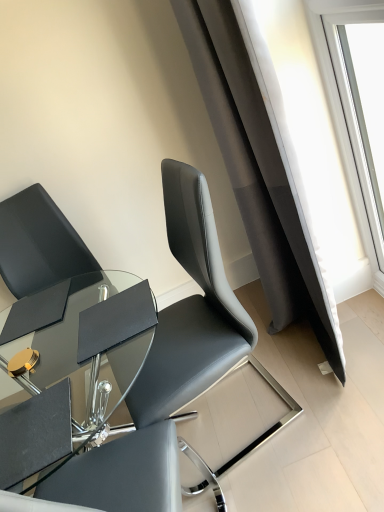
Describe the element at coordinates (66, 302) in the screenshot. I see `black leather chair at left, positioned as the 2th chair in right-to-left order` at that location.

Image resolution: width=384 pixels, height=512 pixels. Describe the element at coordinates (356, 136) in the screenshot. I see `transparent glass window at upper right` at that location.

The height and width of the screenshot is (512, 384). I want to click on black leather chair at left, the first chair when ordered from left to right, so click(66, 302).

Which is more to the left, black leather chair at left, the first chair when ordered from left to right, or matte black chair at upper left, the second chair from the left?

Positioned to the left is black leather chair at left, the first chair when ordered from left to right.

Locate an element on the screen. This screenshot has width=384, height=512. chair below the matte black chair at upper left, the second chair from the left (from the image's perspective) is located at coordinates (66, 302).

From the image's perspective, which is above, black leather chair at left, the first chair when ordered from left to right, or matte black chair at upper left, which is the first chair from right to left?

matte black chair at upper left, which is the first chair from right to left, from the image's perspective.

Does black leather chair at left, the first chair when ordered from left to right, have a greater width compared to matte black chair at upper left, the second chair from the left?

Indeed, black leather chair at left, the first chair when ordered from left to right, has a greater width compared to matte black chair at upper left, the second chair from the left.

Is transparent glass window at upper right taller than matte black chair at upper left, the second chair from the left?

Yes.

Would you say transparent glass window at upper right is a long distance from matte black chair at upper left, which is the first chair from right to left?

They are positioned close to each other.

Is transparent glass window at upper right surrounding matte black chair at upper left, the second chair from the left?

No, matte black chair at upper left, the second chair from the left, is not surrounded by transparent glass window at upper right.

Which is more to the right, transparent glass window at upper right or matte black chair at upper left, which is the first chair from right to left?

transparent glass window at upper right is more to the right.

This screenshot has width=384, height=512. Identify the location of window that appears above the black leather chair at left, the first chair when ordered from left to right (from the image's perspective). (356, 136).

From the image's perspective, which is above, transparent glass window at upper right or black leather chair at left, positioned as the 2th chair in right-to-left order?

transparent glass window at upper right appears higher in the image.

Does transparent glass window at upper right lie behind black leather chair at left, the first chair when ordered from left to right?

No, the depth of transparent glass window at upper right is less than that of black leather chair at left, the first chair when ordered from left to right.

Is point (337, 91) in front of point (47, 276)?

Yes, point (337, 91) is closer to viewer.

Could you tell me if matte black chair at upper left, which is the first chair from right to left, is turned towards black leather chair at left, positioned as the 2th chair in right-to-left order?

No.

From the image's perspective, between matte black chair at upper left, the second chair from the left, and black leather chair at left, positioned as the 2th chair in right-to-left order, which one is located above?

From the image's view, matte black chair at upper left, the second chair from the left, is above.

This screenshot has height=512, width=384. I want to click on chair in front of the black leather chair at left, positioned as the 2th chair in right-to-left order, so click(197, 325).

Is matte black chair at upper left, which is the first chair from right to left, next to black leather chair at left, the first chair when ordered from left to right?

No, matte black chair at upper left, which is the first chair from right to left, is not next to black leather chair at left, the first chair when ordered from left to right.

From a real-world perspective, which is physically below, matte black chair at upper left, which is the first chair from right to left, or transparent glass window at upper right?

matte black chair at upper left, which is the first chair from right to left, is physically lower.

Is matte black chair at upper left, which is the first chair from right to left, looking in the opposite direction of transparent glass window at upper right?

Yes, matte black chair at upper left, which is the first chair from right to left, is facing away from transparent glass window at upper right.

From the image's perspective, is matte black chair at upper left, the second chair from the left, positioned above or below transparent glass window at upper right?

Clearly, from the image's perspective, matte black chair at upper left, the second chair from the left, is below transparent glass window at upper right.

Who is more distant, matte black chair at upper left, the second chair from the left, or transparent glass window at upper right?

transparent glass window at upper right is more distant.

Is black leather chair at left, the first chair when ordered from left to right, inside the boundaries of transparent glass window at upper right, or outside?

black leather chair at left, the first chair when ordered from left to right, cannot be found inside transparent glass window at upper right.

From the picture: Between black leather chair at left, positioned as the 2th chair in right-to-left order, and transparent glass window at upper right, which one has smaller width?

With smaller width is transparent glass window at upper right.

From a real-world perspective, is black leather chair at left, the first chair when ordered from left to right, physically below transparent glass window at upper right?

Yes, from a real-world perspective, black leather chair at left, the first chair when ordered from left to right, is below transparent glass window at upper right.

You are a GUI agent. You are given a task and a screenshot of the screen. Output one action in this format:
    pyautogui.click(x=<x>, y=<y>)
    Task: Click on the chair located on the left of matte black chair at upper left, which is the first chair from right to left
    This screenshot has height=512, width=384.
    Given the screenshot: What is the action you would take?
    pyautogui.click(x=66, y=302)

You are a GUI agent. You are given a task and a screenshot of the screen. Output one action in this format:
    pyautogui.click(x=<x>, y=<y>)
    Task: Click on the 1st chair below the transparent glass window at upper right (from a real-world perspective)
    The height and width of the screenshot is (512, 384).
    Given the screenshot: What is the action you would take?
    [197, 325]

From the picture: Estimate the real-world distances between objects in this image. Which object is closer to matte black chair at upper left, the second chair from the left, black leather chair at left, positioned as the 2th chair in right-to-left order, or transparent glass window at upper right?

The object closer to matte black chair at upper left, the second chair from the left, is black leather chair at left, positioned as the 2th chair in right-to-left order.

Estimate the real-world distances between objects in this image. Which object is further from black leather chair at left, positioned as the 2th chair in right-to-left order, transparent glass window at upper right or matte black chair at upper left, the second chair from the left?

transparent glass window at upper right is positioned further to the anchor black leather chair at left, positioned as the 2th chair in right-to-left order.

Based on the photo, estimate the real-world distances between objects in this image. Which object is further from matte black chair at upper left, which is the first chair from right to left, transparent glass window at upper right or black leather chair at left, the first chair when ordered from left to right?

transparent glass window at upper right is positioned further to the anchor matte black chair at upper left, which is the first chair from right to left.

From the image, which object appears to be nearer to black leather chair at left, the first chair when ordered from left to right, matte black chair at upper left, which is the first chair from right to left, or transparent glass window at upper right?

The object closer to black leather chair at left, the first chair when ordered from left to right, is matte black chair at upper left, which is the first chair from right to left.

Considering their positions, is black leather chair at left, positioned as the 2th chair in right-to-left order, positioned closer to transparent glass window at upper right than matte black chair at upper left, the second chair from the left?

Based on the image, matte black chair at upper left, the second chair from the left, appears to be nearer to transparent glass window at upper right.

Considering their positions, is matte black chair at upper left, the second chair from the left, positioned closer to transparent glass window at upper right than black leather chair at left, the first chair when ordered from left to right?

Based on the image, matte black chair at upper left, the second chair from the left, appears to be nearer to transparent glass window at upper right.

Identify the location of chair between black leather chair at left, positioned as the 2th chair in right-to-left order, and transparent glass window at upper right. (197, 325).